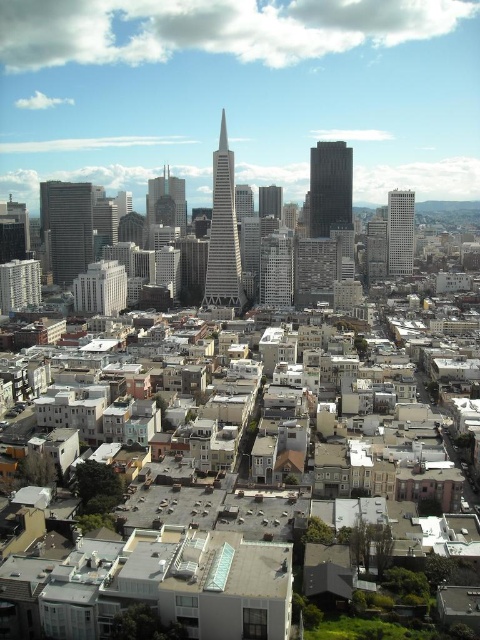
Is black glass skyscraper at center further to camera compared to glassy steel skyscraper at center?

That is True.

Who is higher up, black glass skyscraper at center or glassy steel skyscraper at center?

Positioned higher is black glass skyscraper at center.

Is point (326, 228) less distant than point (177, 208)?

Yes, it is.

Image resolution: width=480 pixels, height=640 pixels. In order to click on black glass skyscraper at center in this screenshot , I will do `click(330, 188)`.

Is silver glass skyscraper at center shorter than black glass skyscraper at center?

No.

What do you see at coordinates (223, 234) in the screenshot? The image size is (480, 640). I see `silver glass skyscraper at center` at bounding box center [223, 234].

Which is in front, point (226, 205) or point (316, 227)?

Point (226, 205)

The image size is (480, 640). Find the location of `silver glass skyscraper at center`. silver glass skyscraper at center is located at coordinates (223, 234).

Based on the photo, between dark gray concrete skyscraper at left and smooth glass skyscraper at center, which one is positioned lower?

Positioned lower is dark gray concrete skyscraper at left.

Consider the image. Can you confirm if dark gray concrete skyscraper at left is shorter than smooth glass skyscraper at center?

No, dark gray concrete skyscraper at left is not shorter than smooth glass skyscraper at center.

Is point (70, 257) positioned in front of point (264, 212)?

No, it is behind (264, 212).

Where is `dark gray concrete skyscraper at left`? dark gray concrete skyscraper at left is located at coordinates (67, 227).